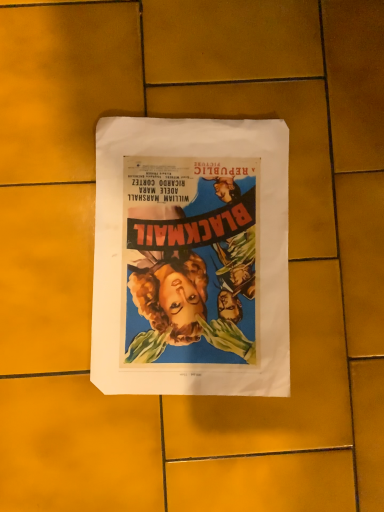
Find the location of `free space above matte paper poster at center (from a real-world perspective)`. free space above matte paper poster at center (from a real-world perspective) is located at coordinates (188, 250).